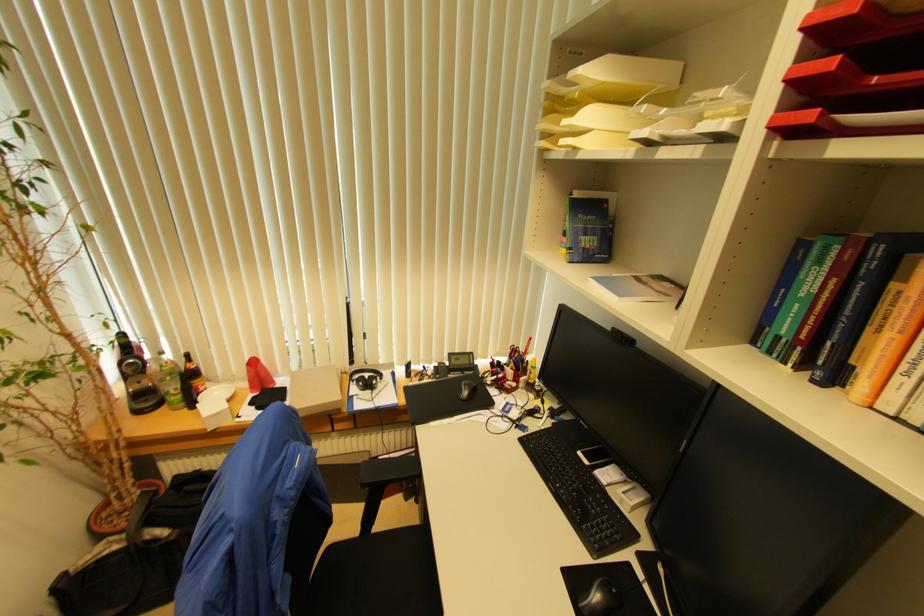
Find the location of a particular element. This screenshot has height=616, width=924. orange book is located at coordinates (886, 333).